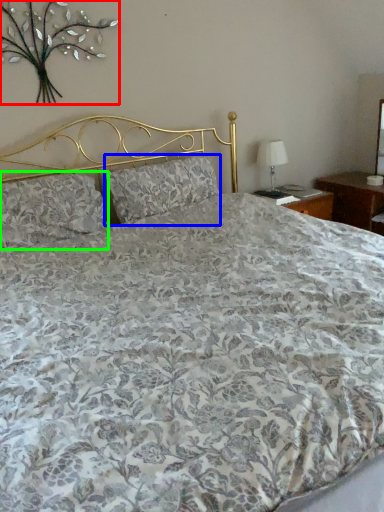
Question: Which object is the closest to the floral arrangement (highlighted by a red box)? Choose among these: pillow (highlighted by a blue box) or pillow (highlighted by a green box).

Choices:
 (A) pillow
 (B) pillow

Answer: (B)